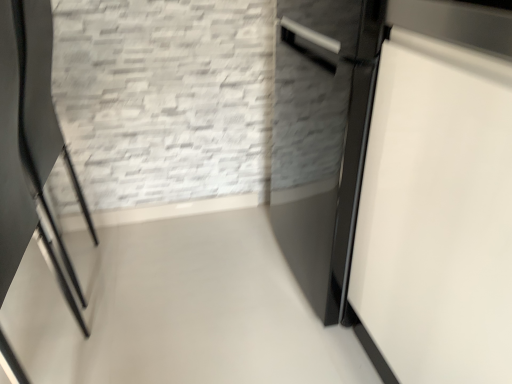
What do you see at coordinates (32, 148) in the screenshot?
I see `black glossy chair at left` at bounding box center [32, 148].

Where is `black glossy chair at left`? The width and height of the screenshot is (512, 384). black glossy chair at left is located at coordinates (32, 148).

In order to face white glossy door at right, should I rotate leftwards or rightwards?

Turn right approximately 22.407 degrees to face it.

This screenshot has width=512, height=384. I want to click on white glossy door at right, so click(436, 216).

Describe the element at coordinates (436, 216) in the screenshot. I see `white glossy door at right` at that location.

The height and width of the screenshot is (384, 512). In order to click on black glossy chair at left in this screenshot , I will do [32, 148].

Considering the positions of objects black glossy chair at left and white glossy door at right in the image provided, who is more to the left, black glossy chair at left or white glossy door at right?

black glossy chair at left.

Considering their positions, is black glossy chair at left located in front of or behind white glossy door at right?

Visually, black glossy chair at left is located behind white glossy door at right.

Is point (30, 65) positioned in front of point (412, 149)?

No.

From the image's perspective, would you say black glossy chair at left is positioned over white glossy door at right?

No.

From a real-world perspective, which is physically above, black glossy chair at left or white glossy door at right?

white glossy door at right is physically above.

Which object is wider, black glossy chair at left or white glossy door at right?

With larger width is white glossy door at right.

Does black glossy chair at left have a lesser height compared to white glossy door at right?

Indeed, black glossy chair at left has a lesser height compared to white glossy door at right.

Which of these two, black glossy chair at left or white glossy door at right, is bigger?

white glossy door at right.

Does black glossy chair at left contain white glossy door at right?

That's incorrect, white glossy door at right is not inside black glossy chair at left.

Is black glossy chair at left far away from white glossy door at right?

They are positioned close to each other.

Is black glossy chair at left facing towards white glossy door at right?

No.

How different are the orientations of black glossy chair at left and white glossy door at right in degrees?

The facing directions of black glossy chair at left and white glossy door at right are 0.158 degrees apart.

I want to click on chair below the white glossy door at right (from a real-world perspective), so click(x=32, y=148).

Which object is positioned more to the right, white glossy door at right or black glossy chair at left?

Positioned to the right is white glossy door at right.

Which object is further away from the camera taking this photo, white glossy door at right or black glossy chair at left?

Positioned behind is black glossy chair at left.

Considering the points (483, 365) and (32, 201), which point is in front, point (483, 365) or point (32, 201)?

The point (483, 365) is more forward.

From the image's perspective, which is above, white glossy door at right or black glossy chair at left?

white glossy door at right is shown above in the image.

From a real-world perspective, which object stands above the other?

white glossy door at right is physically above.

Considering the sizes of objects white glossy door at right and black glossy chair at left in the image provided, who is thinner, white glossy door at right or black glossy chair at left?

With smaller width is black glossy chair at left.

Consider the image. Does white glossy door at right have a lesser height compared to black glossy chair at left?

In fact, white glossy door at right may be taller than black glossy chair at left.

Considering the sizes of white glossy door at right and black glossy chair at left in the image, is white glossy door at right bigger or smaller than black glossy chair at left?

white glossy door at right is bigger than black glossy chair at left.

Would you say white glossy door at right is outside black glossy chair at left?

Yes.

Consider the image. Is there a large distance between white glossy door at right and black glossy chair at left?

No, there isn't a large distance between white glossy door at right and black glossy chair at left.

Is white glossy door at right oriented away from black glossy chair at left?

white glossy door at right does not have its back to black glossy chair at left.

Image resolution: width=512 pixels, height=384 pixels. I want to click on chair below the white glossy door at right (from the image's perspective), so click(x=32, y=148).

Find the location of a particular element. door positioned vertically above the black glossy chair at left (from a real-world perspective) is located at coordinates (436, 216).

The height and width of the screenshot is (384, 512). Find the location of `door in front of the black glossy chair at left`. door in front of the black glossy chair at left is located at coordinates (436, 216).